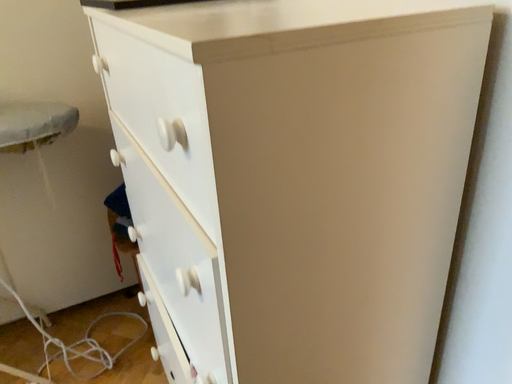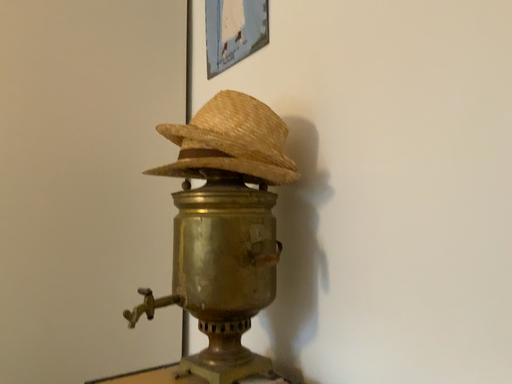
Question: Which way did the camera rotate in the video?

Choices:
 (A) rotated left
 (B) rotated right

Answer: (B)